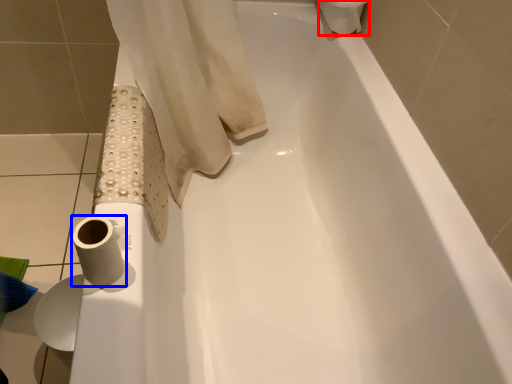
Question: Which point is closer to the camera, toilet paper (highlighted by a red box) or toilet paper (highlighted by a blue box)?

Choices:
 (A) toilet paper
 (B) toilet paper

Answer: (B)